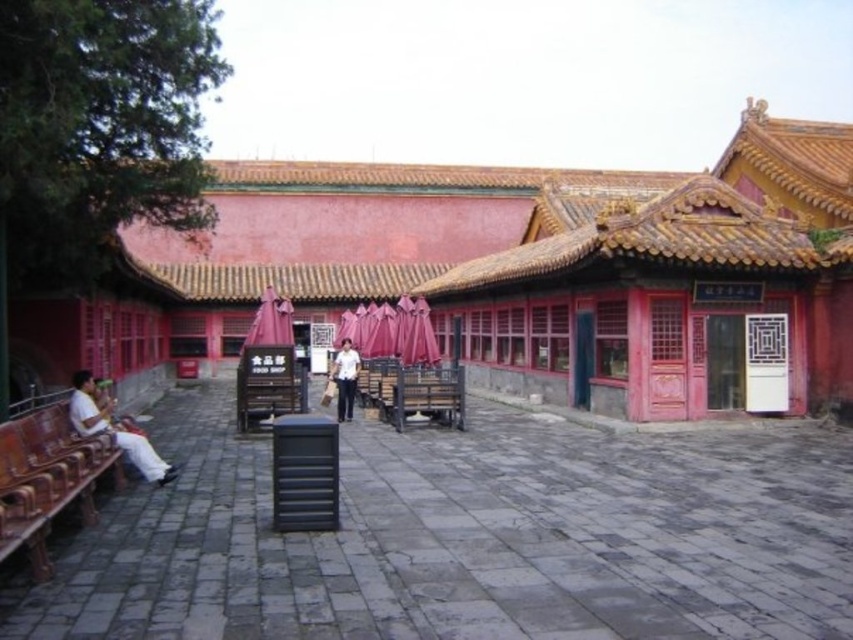
Is point (407, 205) closer to camera compared to point (77, 401)?

No.

Is point (656, 401) positioned behind point (120, 449)?

Yes, it is behind point (120, 449).

Locate an element on the screen. This screenshot has height=640, width=853. matte red building at center is located at coordinates (514, 275).

Between matte red building at center and white matte shirt at center, which one is positioned higher?

matte red building at center

Can you confirm if matte red building at center is thinner than white matte shirt at center?

No.

Locate an element on the screen. The width and height of the screenshot is (853, 640). matte red building at center is located at coordinates (514, 275).

Can you confirm if matte red building at center is taller than wooden bench at lower left?

Yes.

The height and width of the screenshot is (640, 853). Find the location of `matte red building at center`. matte red building at center is located at coordinates (514, 275).